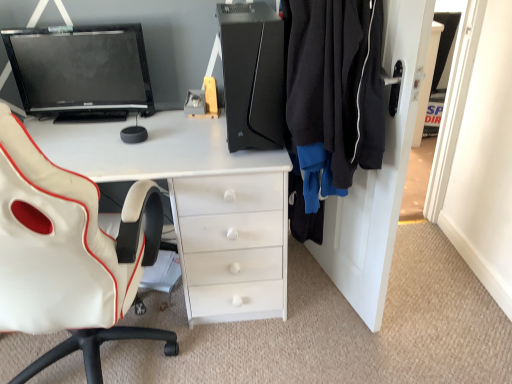
I want to click on free space in front of matte black monitor at upper left, so click(96, 136).